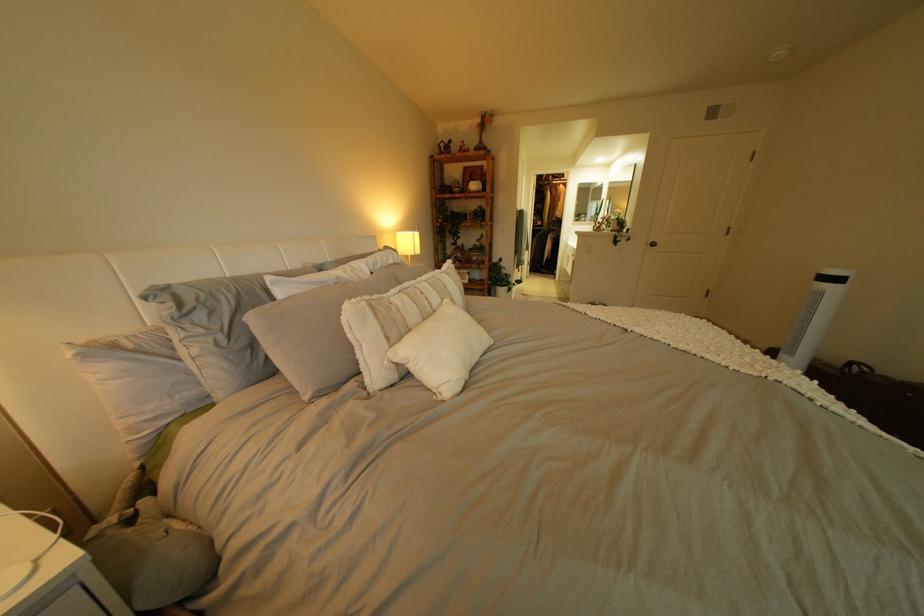
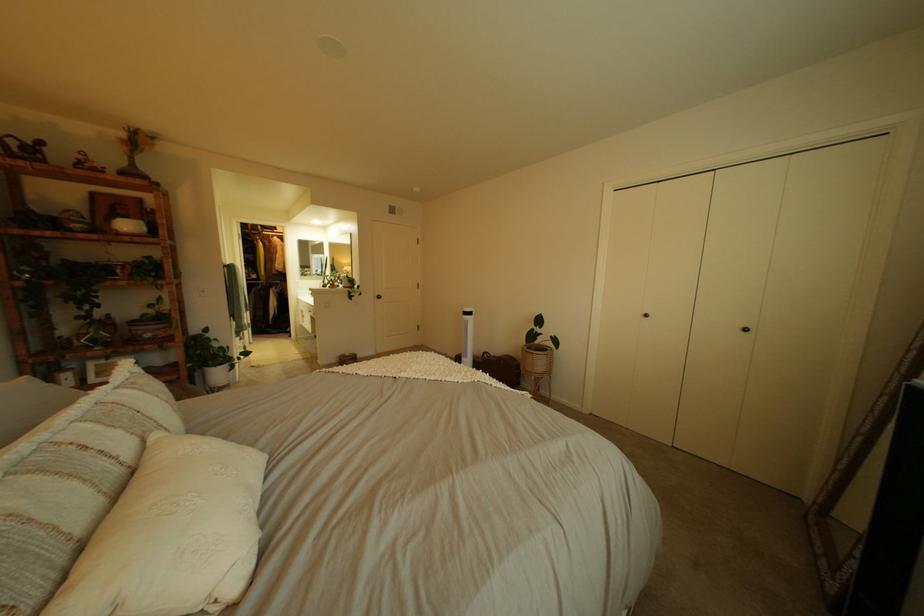
In the second image, find the point that corresponds to [463,302] in the first image.

(172, 436)